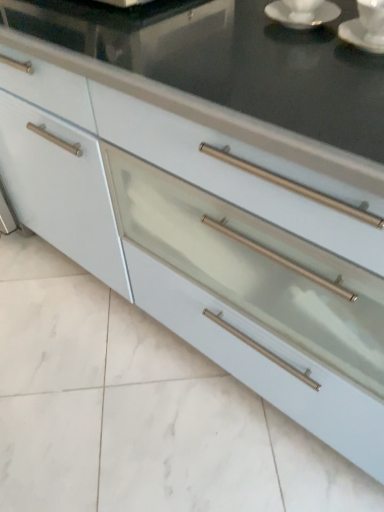
Question: Looking at their shapes, would you say white glossy saucer at upper right is wider or thinner than satin white drawer at center?

Choices:
 (A) wide
 (B) thin

Answer: (B)

Question: Considering the positions of point (367, 38) and point (228, 310), is point (367, 38) closer or farther from the camera than point (228, 310)?

Choices:
 (A) closer
 (B) farther

Answer: (A)

Question: Which object is positioned farthest from the white glossy saucer at upper right, which appears as the second saucer when viewed from the right?

Choices:
 (A) white glossy saucer at upper right
 (B) white ceramic saucer at upper right, the 1th saucer viewed from the right
 (C) satin white drawer at center

Answer: (C)

Question: Estimate the real-world distances between objects in this image. Which object is farther from the satin white drawer at center?

Choices:
 (A) white ceramic saucer at upper right, the 1th saucer viewed from the right
 (B) white glossy saucer at upper right
 (C) white glossy saucer at upper right, which appears as the second saucer when viewed from the right

Answer: (C)